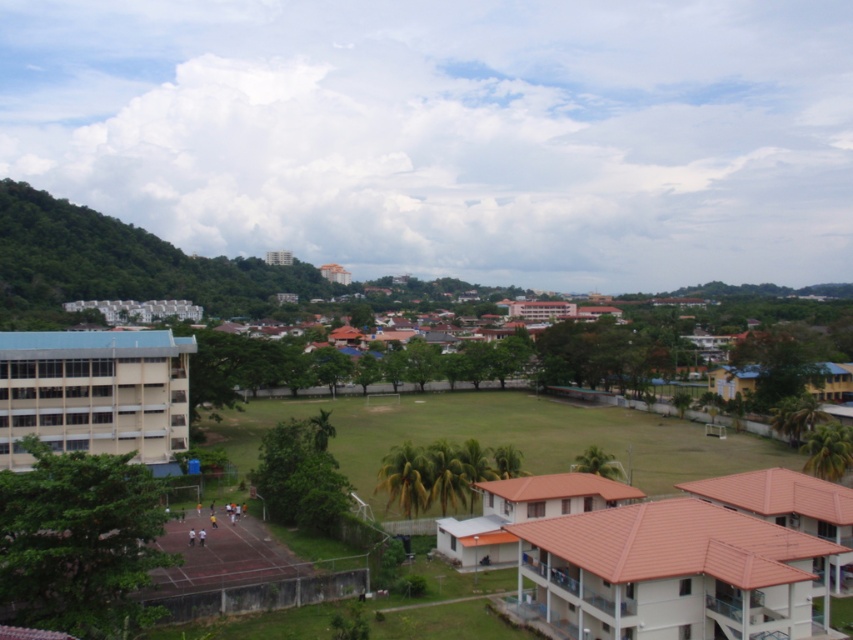
Is blue glass building at left shorter than brown tile roof house at center?

Incorrect, blue glass building at left's height does not fall short of brown tile roof house at center's.

Who is more distant from viewer, (33, 344) or (578, 484)?

The point (33, 344) is behind.

You are a GUI agent. You are given a task and a screenshot of the screen. Output one action in this format:
    pyautogui.click(x=<x>, y=<y>)
    Task: Click on the blue glass building at left
    
    Given the screenshot: What is the action you would take?
    pyautogui.click(x=94, y=394)

Can you confirm if white tile building at lower right is smaller than brown tile roof house at center?

Indeed, white tile building at lower right has a smaller size compared to brown tile roof house at center.

Does point (787, 596) come farther from viewer compared to point (463, 531)?

That is False.

Image resolution: width=853 pixels, height=640 pixels. In order to click on white tile building at lower right in this screenshot , I will do `click(674, 573)`.

Can you confirm if white tile building at lower right is positioned to the left of yellow matte building at right?

Correct, you'll find white tile building at lower right to the left of yellow matte building at right.

Who is taller, white tile building at lower right or yellow matte building at right?

Standing taller between the two is white tile building at lower right.

Does point (564, 593) lie behind point (753, 392)?

No, it is not.

Image resolution: width=853 pixels, height=640 pixels. Identify the location of white tile building at lower right. 674,573.